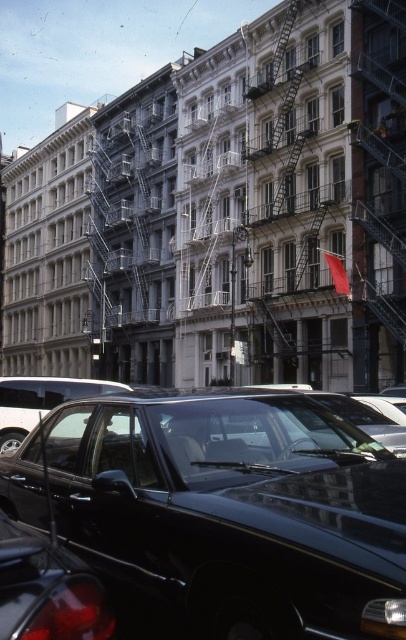
Question: Is glossy black car at lower center to the right of glossy plastic car at lower left from the viewer's perspective?

Choices:
 (A) no
 (B) yes

Answer: (B)

Question: Can you confirm if glossy black car at lower center is thinner than glossy plastic car at lower left?

Choices:
 (A) no
 (B) yes

Answer: (A)

Question: Considering the relative positions of glossy black car at lower center and glossy plastic car at lower left in the image provided, where is glossy black car at lower center located with respect to glossy plastic car at lower left?

Choices:
 (A) left
 (B) right

Answer: (B)

Question: Which object appears farthest from the camera in this image?

Choices:
 (A) glossy plastic car at lower left
 (B) glossy black car at lower center

Answer: (B)

Question: Which of the following is the closest to the observer?

Choices:
 (A) glossy plastic car at lower left
 (B) glossy black car at lower center

Answer: (A)